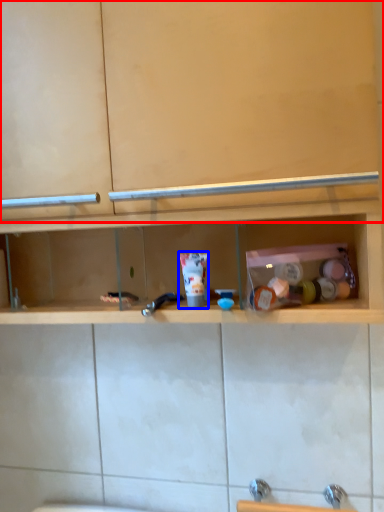
Question: Which point is closer to the camera, cabinet (highlighted by a red box) or toiletry (highlighted by a blue box)?

Choices:
 (A) cabinet
 (B) toiletry

Answer: (A)